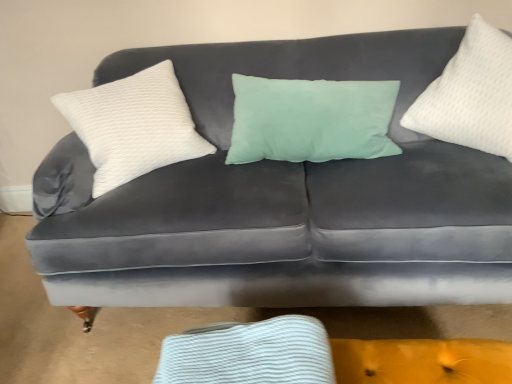
Question: Is white textured pillow at right, the 1th pillow from the right, thinner than white textured pillow at left, acting as the first pillow starting from the left?

Choices:
 (A) yes
 (B) no

Answer: (A)

Question: Is white textured pillow at right, the 1th pillow from the right, positioned behind white textured pillow at left, arranged as the second pillow when viewed from the right?

Choices:
 (A) yes
 (B) no

Answer: (B)

Question: From a real-world perspective, is white textured pillow at right, the 1th pillow from the right, physically above white textured pillow at left, acting as the first pillow starting from the left?

Choices:
 (A) no
 (B) yes

Answer: (B)

Question: Is white textured pillow at right, the 1th pillow from the right, looking in the opposite direction of white textured pillow at left, arranged as the second pillow when viewed from the right?

Choices:
 (A) yes
 (B) no

Answer: (B)

Question: Could white textured pillow at left, acting as the first pillow starting from the left, be considered to be inside white textured pillow at right, the 1th pillow from the right?

Choices:
 (A) yes
 (B) no

Answer: (B)

Question: Is white textured pillow at right, which appears as the second pillow when viewed from the left, with white textured pillow at left, arranged as the second pillow when viewed from the right?

Choices:
 (A) yes
 (B) no

Answer: (B)

Question: Is white textured pillow at right, the 1th pillow from the right, inside white textured pillow at left, arranged as the second pillow when viewed from the right?

Choices:
 (A) no
 (B) yes

Answer: (A)

Question: Is white textured pillow at left, acting as the first pillow starting from the left, bigger than white textured pillow at right, which appears as the second pillow when viewed from the left?

Choices:
 (A) yes
 (B) no

Answer: (A)

Question: Are white textured pillow at left, acting as the first pillow starting from the left, and white textured pillow at right, which appears as the second pillow when viewed from the left, beside each other?

Choices:
 (A) no
 (B) yes

Answer: (A)

Question: From a real-world perspective, does white textured pillow at left, acting as the first pillow starting from the left, stand above white textured pillow at right, the 1th pillow from the right?

Choices:
 (A) no
 (B) yes

Answer: (A)

Question: From the image's perspective, is white textured pillow at left, acting as the first pillow starting from the left, on top of white textured pillow at right, which appears as the second pillow when viewed from the left?

Choices:
 (A) yes
 (B) no

Answer: (B)

Question: Is the depth of white textured pillow at left, acting as the first pillow starting from the left, less than that of white textured pillow at right, which appears as the second pillow when viewed from the left?

Choices:
 (A) no
 (B) yes

Answer: (A)

Question: Would you say white textured pillow at right, which appears as the second pillow when viewed from the left, is inside or outside white textured pillow at left, acting as the first pillow starting from the left?

Choices:
 (A) inside
 (B) outside

Answer: (B)